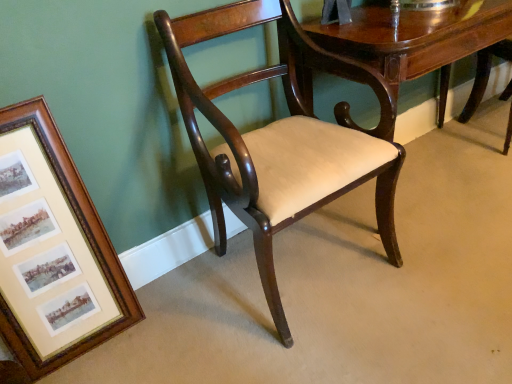
Question: Is wooden framed prints at left spatially inside mahogany wood table at center, or outside of it?

Choices:
 (A) outside
 (B) inside

Answer: (A)

Question: Does point (37, 115) appear closer or farther from the camera than point (448, 69)?

Choices:
 (A) closer
 (B) farther

Answer: (A)

Question: Which object is the closest to the mahogany wood chair at center?

Choices:
 (A) wooden framed prints at left
 (B) mahogany wood table at center

Answer: (B)

Question: Which is nearer to the mahogany wood chair at center?

Choices:
 (A) wooden framed prints at left
 (B) mahogany wood table at center

Answer: (B)